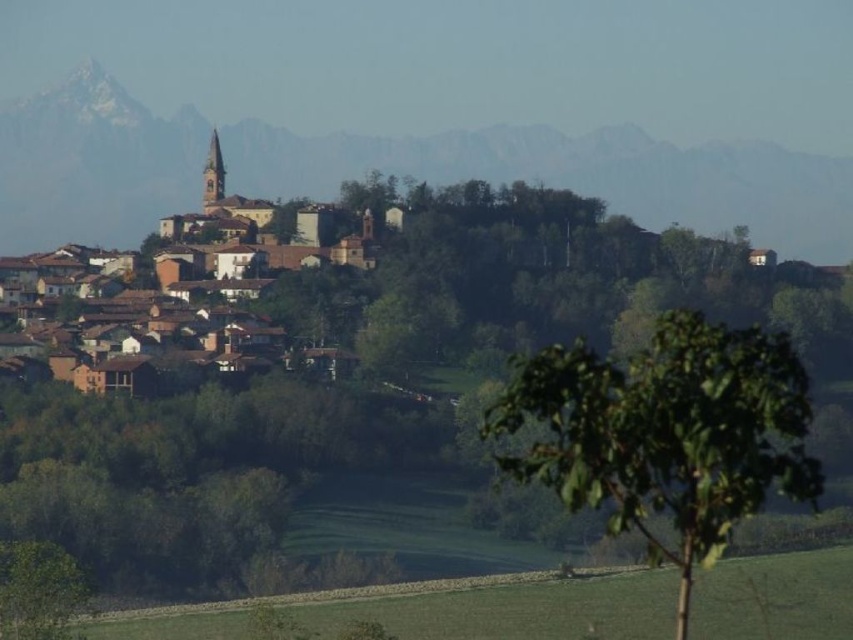
Question: Which point is farther to the camera?

Choices:
 (A) green leafy tree at lower left
 (B) green leafy tree at center
 (C) brown clay houses at center
 (D) snowy rocky mountain at upper center

Answer: (A)

Question: Is snowy rocky mountain at upper center smaller than green leafy tree at lower left?

Choices:
 (A) yes
 (B) no

Answer: (B)

Question: Estimate the real-world distances between objects in this image. Which object is farther from the brown clay houses at center?

Choices:
 (A) snowy rocky mountain at upper center
 (B) green leafy tree at lower left

Answer: (B)

Question: Which object appears farthest from the camera in this image?

Choices:
 (A) green leafy tree at center
 (B) green leafy tree at lower left
 (C) brown clay houses at center

Answer: (B)

Question: Can you confirm if green leafy tree at center is thinner than brown clay houses at center?

Choices:
 (A) yes
 (B) no

Answer: (A)

Question: Can you confirm if brown clay houses at center is positioned above green leafy tree at lower left?

Choices:
 (A) yes
 (B) no

Answer: (A)